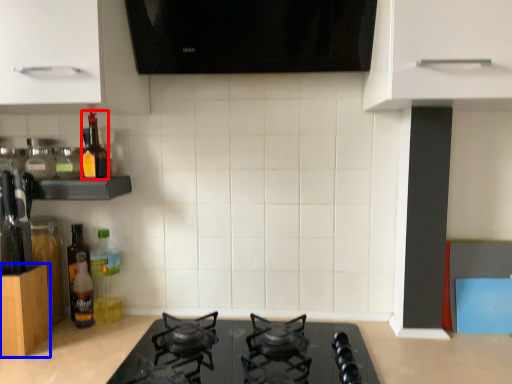
Question: Which object is further to the camera taking this photo, bottle (highlighted by a red box) or cabinetry (highlighted by a blue box)?

Choices:
 (A) bottle
 (B) cabinetry

Answer: (A)